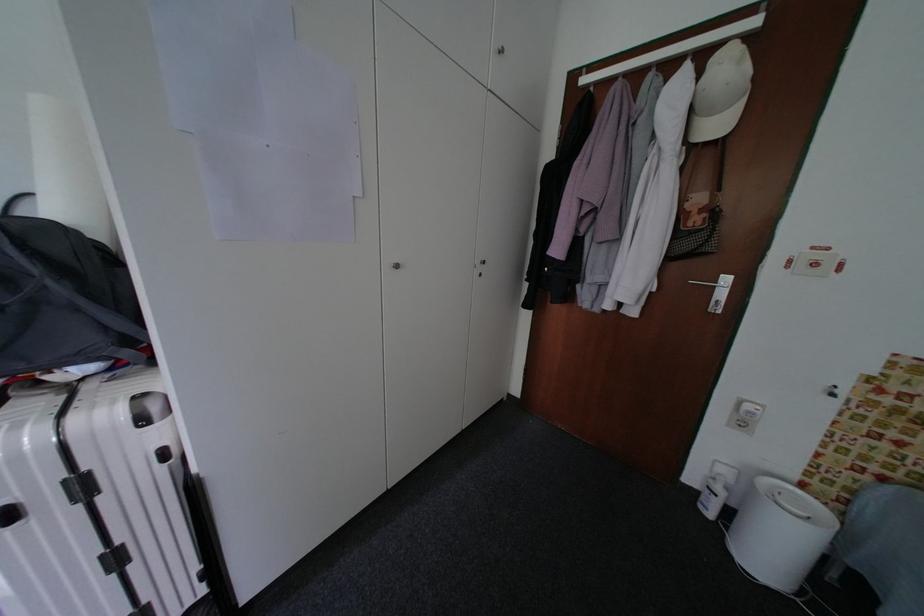
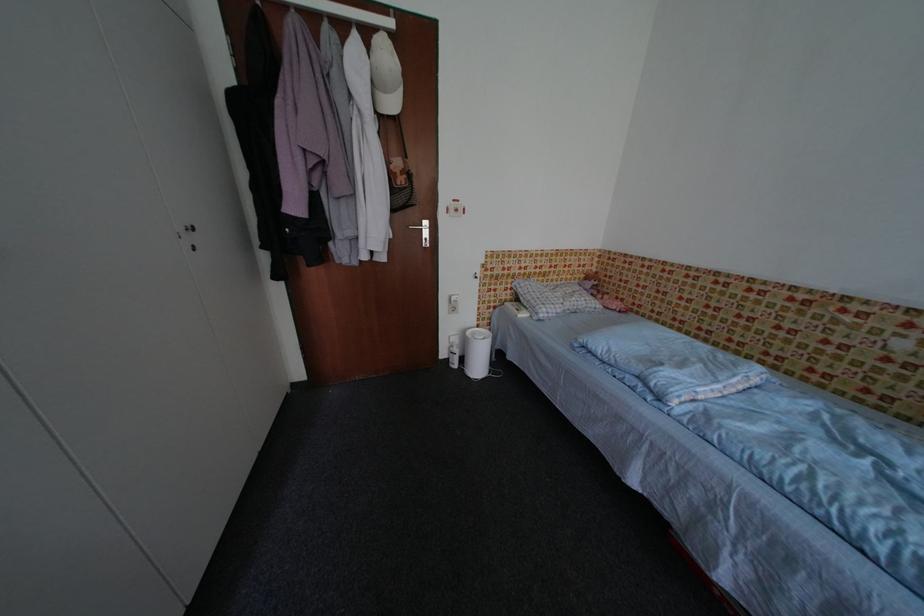
The first image is from the beginning of the video and the second image is from the end. How did the camera likely rotate when shooting the video?

The camera rotated toward right-down.